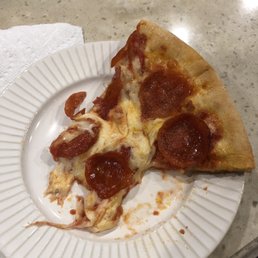
Image resolution: width=258 pixels, height=258 pixels. What are the coordinates of `table` in the screenshot? It's located at (232, 76).